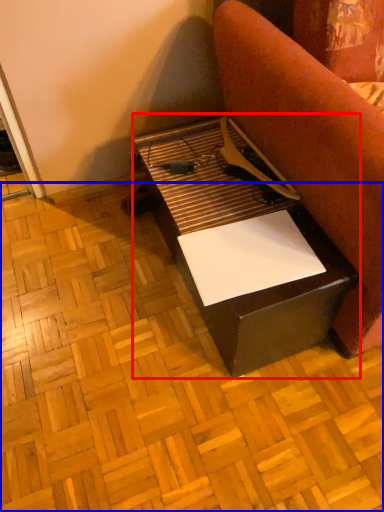
Question: Which object appears farthest to the camera in this image, table (highlighted by a red box) or plywood (highlighted by a blue box)?

Choices:
 (A) table
 (B) plywood

Answer: (A)